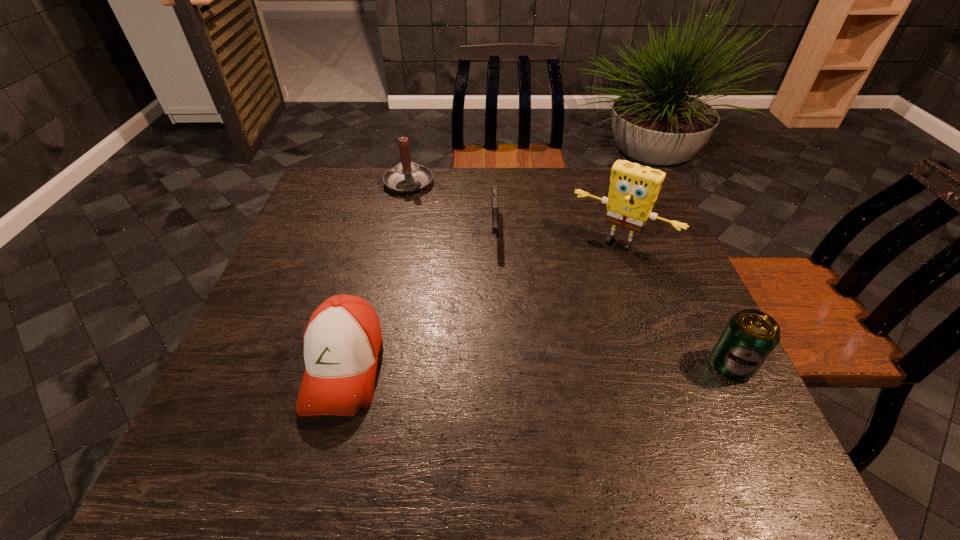
Where is `free spot on the desktop that is between the baseball cap and the beer can and is positioned on the side of the farthest object with the handle loop`? free spot on the desktop that is between the baseball cap and the beer can and is positioned on the side of the farthest object with the handle loop is located at coordinates (526, 366).

This screenshot has width=960, height=540. What are the coordinates of `free space on the desktop that is between the baseball cap and the beer can and is positioned at the muzzle end of the gun` in the screenshot? It's located at (496, 366).

What are the coordinates of `free space on the desktop that is between the baseball cap and the beer can and is positioned on the face of the sponge` in the screenshot? It's located at (537, 366).